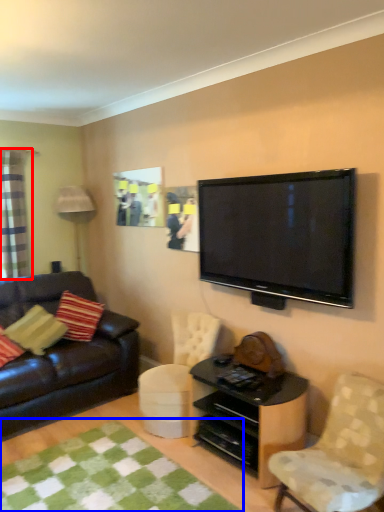
Question: Which point is closer to the camera, curtain (highlighted by a red box) or mat (highlighted by a blue box)?

Choices:
 (A) curtain
 (B) mat

Answer: (B)